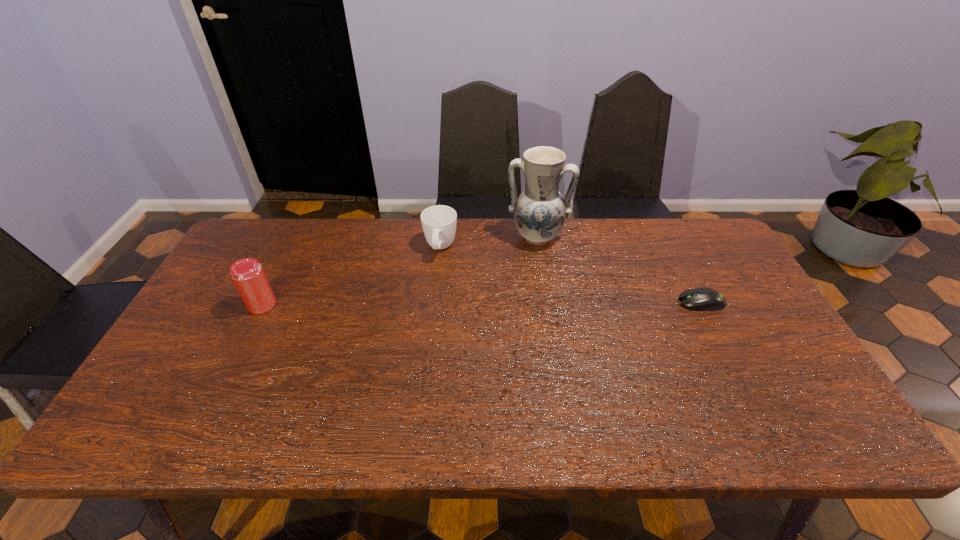
Find the location of `vacant region located on the wheel side of the computer mouse`. vacant region located on the wheel side of the computer mouse is located at coordinates (559, 302).

The width and height of the screenshot is (960, 540). What are the coordinates of `vacant region located 0.320m on the wheel side of the computer mouse` in the screenshot? It's located at (565, 302).

Identify the location of vacant space located 0.230m on either side of the third object from left to right. tap(528, 303).

You are a GUI agent. You are given a task and a screenshot of the screen. Output one action in this format:
    pyautogui.click(x=<x>, y=<y>)
    Task: Click on the vacant position located 0.280m on either side of the third object from left to right
    This screenshot has width=960, height=540.
    Given the screenshot: What is the action you would take?
    pyautogui.click(x=527, y=316)

Find the location of a particular element. vacant region located on either side of the third object from left to right is located at coordinates (528, 312).

In order to click on free spot located 0.380m with the handle on the side of the second object from left to right in this screenshot , I will do `click(419, 364)`.

I want to click on vacant area situated 0.050m with the handle on the side of the second object from left to right, so click(x=436, y=275).

At what (x,y) coordinates should I click in order to perform the action: click on vacant point located with the handle on the side of the second object from left to right. Please return your answer as a coordinate pair (x, y). The image size is (960, 540). Looking at the image, I should click on (431, 301).

At what (x,y) coordinates should I click in order to perform the action: click on pottery situated at the far edge. Please return your answer as a coordinate pair (x, y). This screenshot has width=960, height=540. Looking at the image, I should click on (540, 210).

This screenshot has width=960, height=540. In order to click on cup that is at the far edge in this screenshot , I will do `click(438, 222)`.